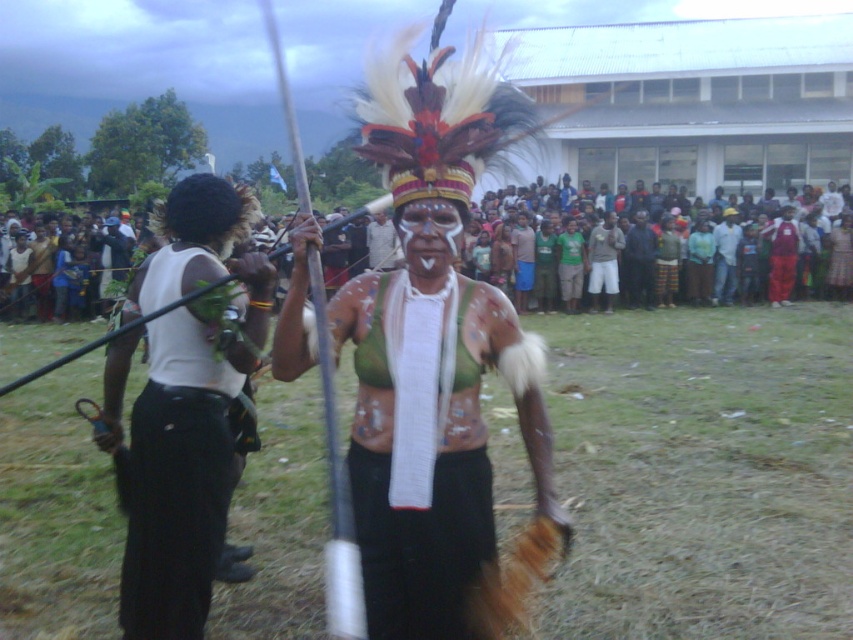
Question: Observing the image, what is the correct spatial positioning of white matte vest at left in reference to red fabric pants at right?

Choices:
 (A) right
 (B) left

Answer: (B)

Question: Can you confirm if white matte face at center is positioned to the right of red fabric pants at right?

Choices:
 (A) no
 (B) yes

Answer: (A)

Question: Which object is farther from the camera taking this photo?

Choices:
 (A) white matte vest at left
 (B) white matte face at center

Answer: (A)

Question: Considering the relative positions of white matte face at center and red fabric pants at right in the image provided, where is white matte face at center located with respect to red fabric pants at right?

Choices:
 (A) below
 (B) above

Answer: (A)

Question: Which of the following is the farthest from the observer?

Choices:
 (A) (440, 268)
 (B) (125, 572)
 (C) (776, 282)
 (D) (357, 458)

Answer: (C)

Question: Which point appears farthest from the camera in this image?

Choices:
 (A) (402, 285)
 (B) (426, 232)
 (C) (792, 260)
 (D) (204, 499)

Answer: (C)